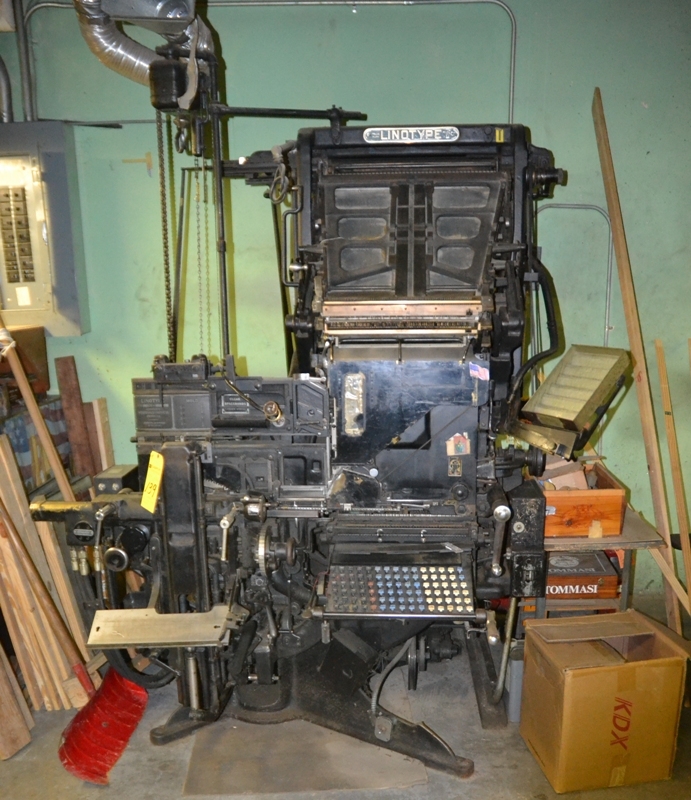
Image resolution: width=691 pixels, height=800 pixels. Identify the location of cardboard box. (582, 680).